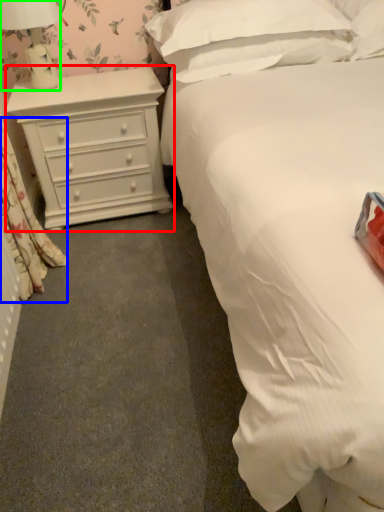
Question: Based on their relative distances, which object is farther from chest of drawers (highlighted by a red box)? Choose from curtain (highlighted by a blue box) and lamp (highlighted by a green box).

Choices:
 (A) curtain
 (B) lamp

Answer: (A)